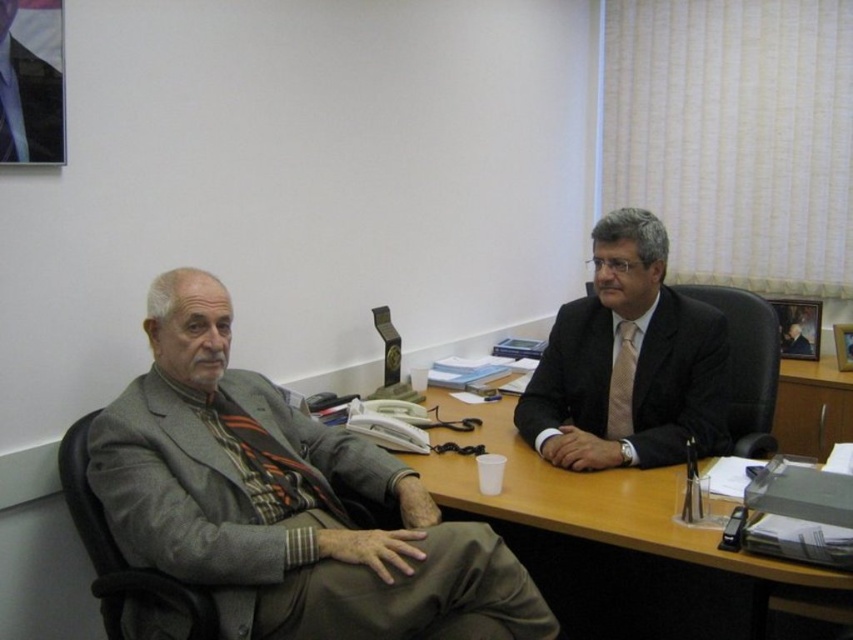
Consider the image. You are a photographer standing in front of the desk. You need to take a photo of both the matte black suit at right and the beige silk tie at center. Which object should you focus on first if you want to capture both in a single shot without moving the camera?

The matte black suit at right is much taller than the beige silk tie at center, so you should focus on the matte black suit at right first to ensure both are in frame.

You are a delivery person who needs to place a small package on the desk. The package requires a clear space of at least 15 inches. Can you place it between the gray wool suit at left and the wooden desk at center?

The distance between the gray wool suit at left and the wooden desk at center is 17.63 inches, which is more than the required 15 inches. Therefore, you can place the package between them.

You are a delivery person who needs to place a 1.5 meter long package between the two people at the desk. Is there enough space between the gray wool suit at left and the other person to fit the package?

The distance between the gray wool suit at left and the other person is 1.47 meters. Since the package is 1.5 meters long, it is slightly too long to fit in the available space.